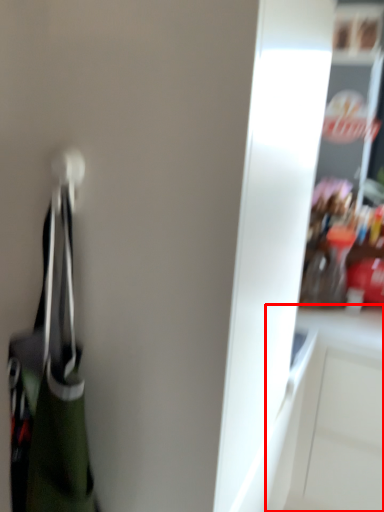
Question: Where is cabinetry (annotated by the red box) located in relation to handbag in the image?

Choices:
 (A) left
 (B) right

Answer: (B)